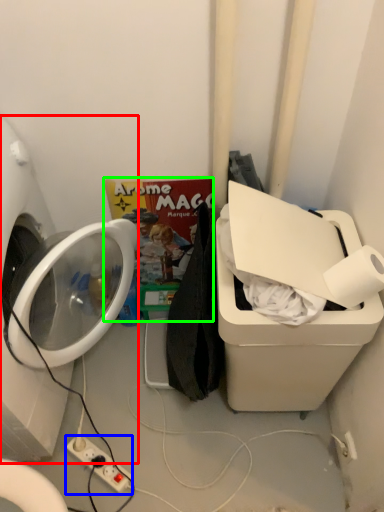
Question: Which object is positioned closest to washing machine (highlighted by a red box)? Select from electric outlet (highlighted by a blue box) and comic book (highlighted by a green box).

Choices:
 (A) electric outlet
 (B) comic book

Answer: (B)